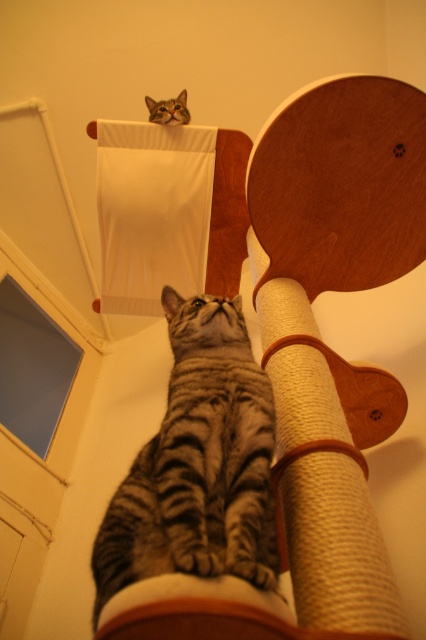
Question: Can you confirm if sanded wood scratching post at center is positioned above tabby fur cat at upper center?

Choices:
 (A) yes
 (B) no

Answer: (B)

Question: Which of these objects is positioned closest to the tabby fur cat at upper center?

Choices:
 (A) gray tabby cat at center
 (B) sanded wood scratching post at center

Answer: (B)

Question: Is sanded wood scratching post at center to the left of gray tabby cat at center from the viewer's perspective?

Choices:
 (A) no
 (B) yes

Answer: (A)

Question: Among these objects, which one is farthest from the camera?

Choices:
 (A) sanded wood scratching post at center
 (B) gray tabby cat at center

Answer: (A)

Question: Can you confirm if gray tabby cat at center is thinner than tabby fur cat at upper center?

Choices:
 (A) yes
 (B) no

Answer: (B)

Question: Which point is closer to the camera?

Choices:
 (A) sanded wood scratching post at center
 (B) gray tabby cat at center
 (C) tabby fur cat at upper center

Answer: (B)